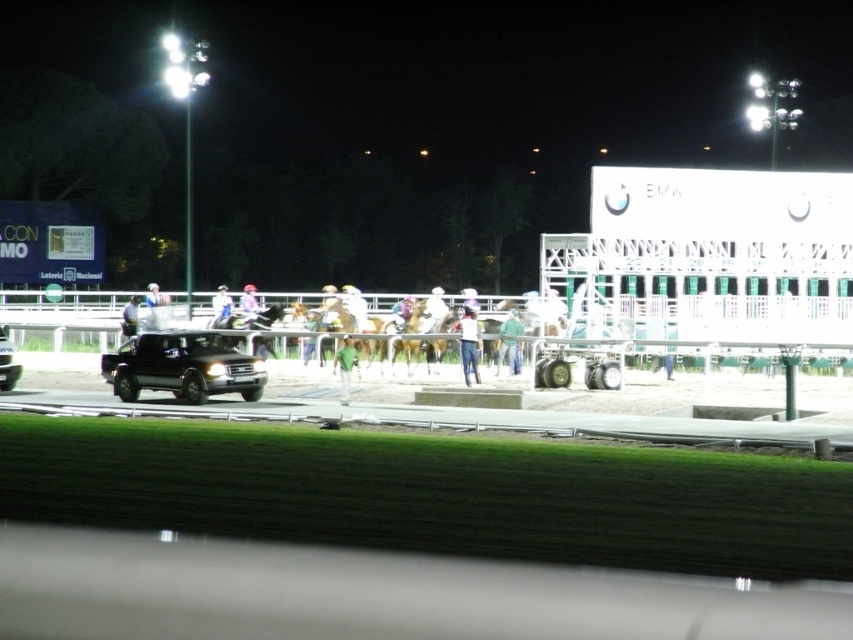
Question: Which of the following is the farthest from the observer?

Choices:
 (A) (508, 330)
 (B) (216, 324)

Answer: (B)

Question: Which object appears closest to the camera in this image?

Choices:
 (A) white fabric cap at center
 (B) shiny black suv at left
 (C) light blue fabric jacket at center

Answer: (B)

Question: Does white matte helmet at center come in front of light blue fabric jacket at center?

Choices:
 (A) yes
 (B) no

Answer: (A)

Question: Which object is farther from the camera taking this photo?

Choices:
 (A) black glossy suv at left
 (B) white matte helmet at center
 (C) shiny black suv at left
 (D) light blue fabric jacket at center

Answer: (D)

Question: Can you confirm if blue jeans at center is wider than black glossy suv at left?

Choices:
 (A) yes
 (B) no

Answer: (B)

Question: Can you confirm if blue jeans at center is smaller than green cotton shirt at center?

Choices:
 (A) no
 (B) yes

Answer: (A)